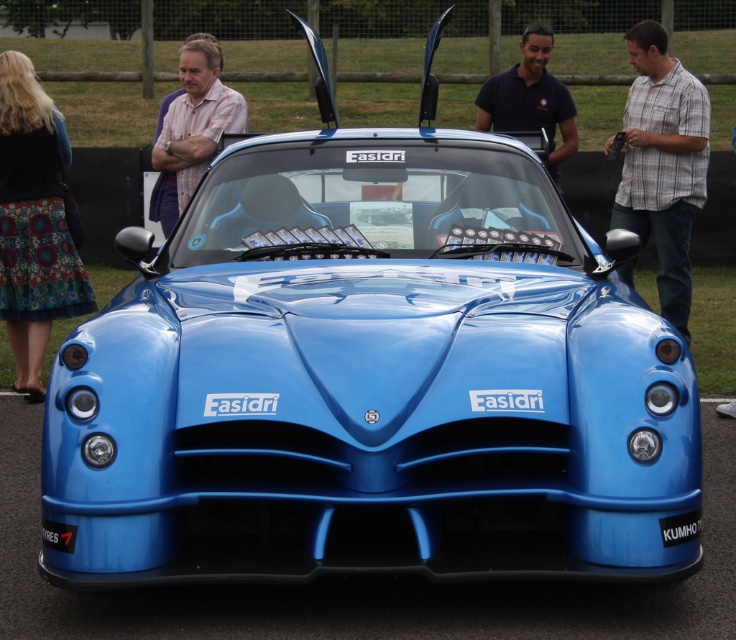
Question: Is pink striped shirt at center positioned behind black shirt at center?

Choices:
 (A) yes
 (B) no

Answer: (B)

Question: Which is farther from the pink striped shirt at center?

Choices:
 (A) black rubber license plate at bottom right
 (B) plaid shirt at center
 (C) matte black car at center

Answer: (A)

Question: Is plaid shirt at center below matte black car at center?

Choices:
 (A) no
 (B) yes

Answer: (A)

Question: Does floral skirt at lower left come in front of plaid shirt at center?

Choices:
 (A) yes
 (B) no

Answer: (A)

Question: Which object is positioned closest to the pink striped shirt at center?

Choices:
 (A) black rubber license plate at bottom right
 (B) black shirt at center
 (C) plaid shirt at center
 (D) matte black car at center

Answer: (B)

Question: Which of the following is the closest to the observer?

Choices:
 (A) (732, 410)
 (B) (676, 544)
 (C) (158, 176)

Answer: (B)